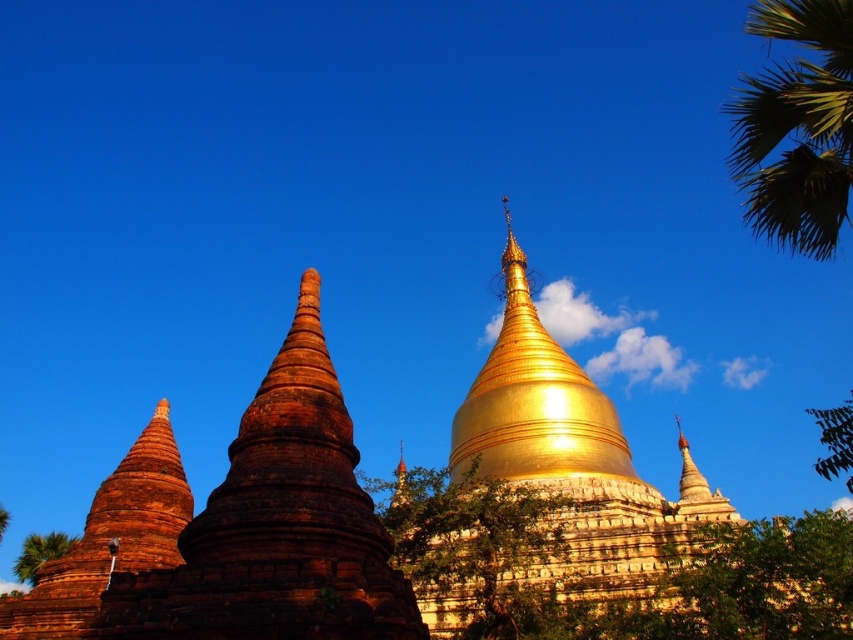
Is green leafy tree at center thinner than polished wood spire at center?

In fact, green leafy tree at center might be wider than polished wood spire at center.

Based on the photo, is green leafy tree at center taller than polished wood spire at center?

Correct, green leafy tree at center is much taller as polished wood spire at center.

The width and height of the screenshot is (853, 640). What do you see at coordinates (474, 548) in the screenshot?
I see `green leafy tree at center` at bounding box center [474, 548].

At what (x,y) coordinates should I click in order to perform the action: click on green leafy tree at center. Please return your answer as a coordinate pair (x, y). The width and height of the screenshot is (853, 640). Looking at the image, I should click on (474, 548).

Can you confirm if green leafy palm at upper right is positioned below green leafy palm tree at lower left?

Incorrect, green leafy palm at upper right is not positioned below green leafy palm tree at lower left.

Measure the distance from green leafy palm at upper right to green leafy palm tree at lower left.

green leafy palm at upper right is 148.82 meters away from green leafy palm tree at lower left.

Who is more forward, (805, 241) or (64, 547)?

Positioned in front is point (805, 241).

Find the location of a particular element. The width and height of the screenshot is (853, 640). green leafy palm at upper right is located at coordinates (796, 128).

Can you confirm if green leafy palm at upper right is positioned to the left of green leafy tree at center?

In fact, green leafy palm at upper right is to the right of green leafy tree at center.

Does point (821, 100) lie behind point (477, 627)?

That is False.

Where is `green leafy palm at upper right`? The height and width of the screenshot is (640, 853). green leafy palm at upper right is located at coordinates (796, 128).